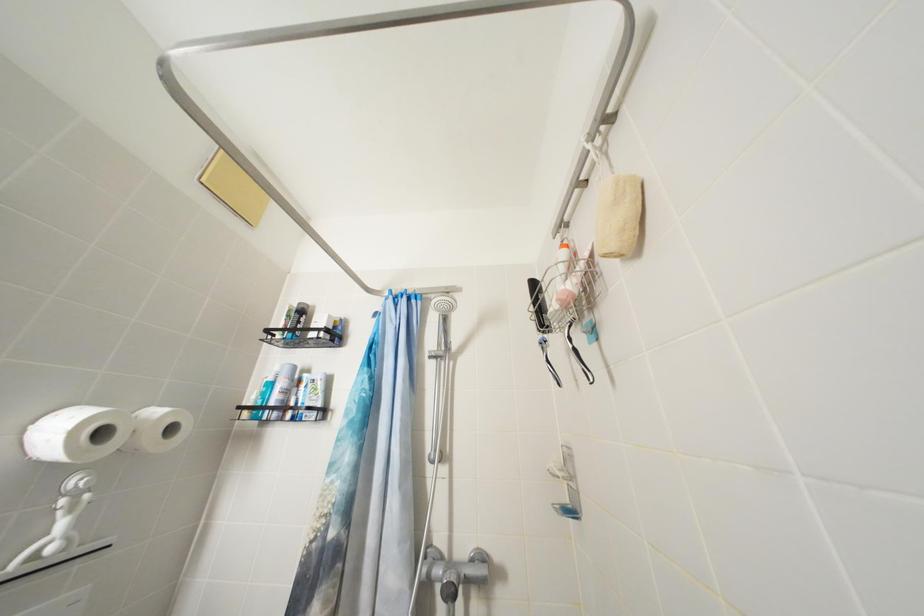
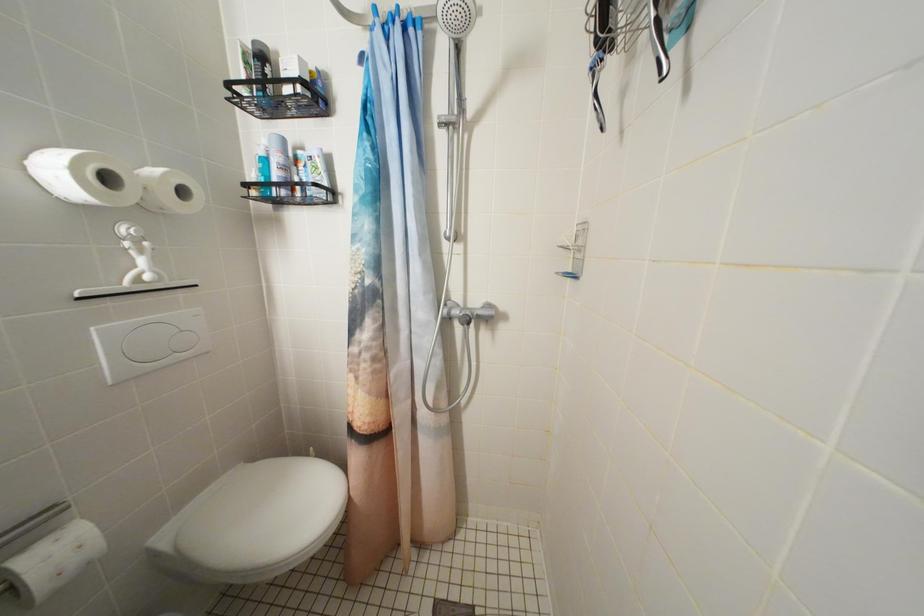
Question: The images are taken continuously from a first-person perspective. In which direction is your viewpoint rotating?

Choices:
 (A) Left
 (B) Right
 (C) Up
 (D) Down

Answer: (D)